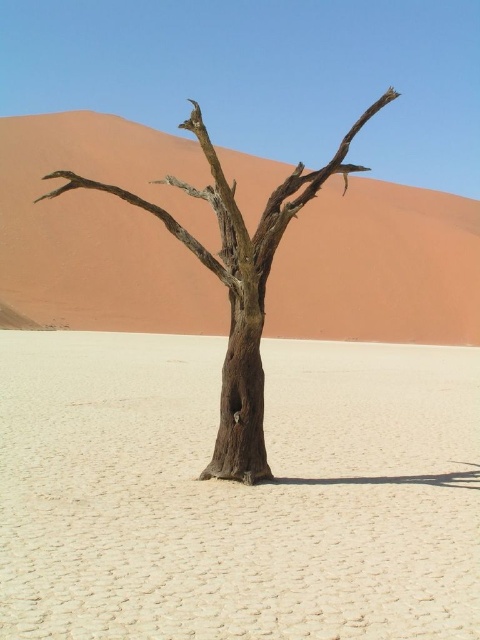
Question: Which object appears closest to the camera in this image?

Choices:
 (A) brown rough tree at center
 (B) dried mud tree at center
 (C) dark brown rough tree trunk at center

Answer: (B)

Question: Does dried mud tree at center have a smaller size compared to dark brown rough tree trunk at center?

Choices:
 (A) no
 (B) yes

Answer: (A)

Question: Estimate the real-world distances between objects in this image. Which object is farther from the brown rough tree at center?

Choices:
 (A) dark brown rough tree trunk at center
 (B) dried mud tree at center

Answer: (B)

Question: Where is dried mud tree at center located in relation to dark brown rough tree trunk at center in the image?

Choices:
 (A) below
 (B) above

Answer: (A)

Question: Which is nearer to the dark brown rough tree trunk at center?

Choices:
 (A) dried mud tree at center
 (B) brown rough tree at center

Answer: (B)

Question: Can you confirm if brown rough tree at center is smaller than dark brown rough tree trunk at center?

Choices:
 (A) no
 (B) yes

Answer: (A)